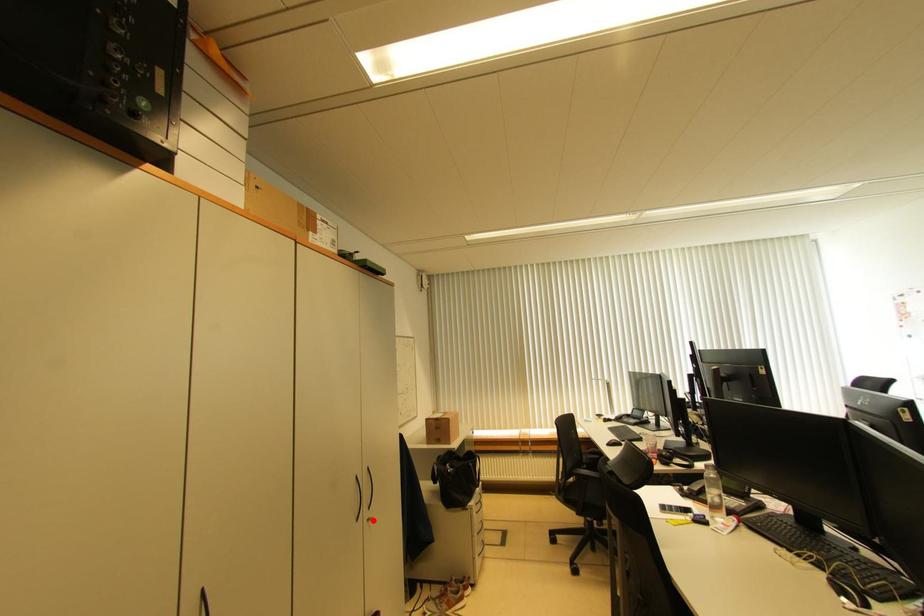
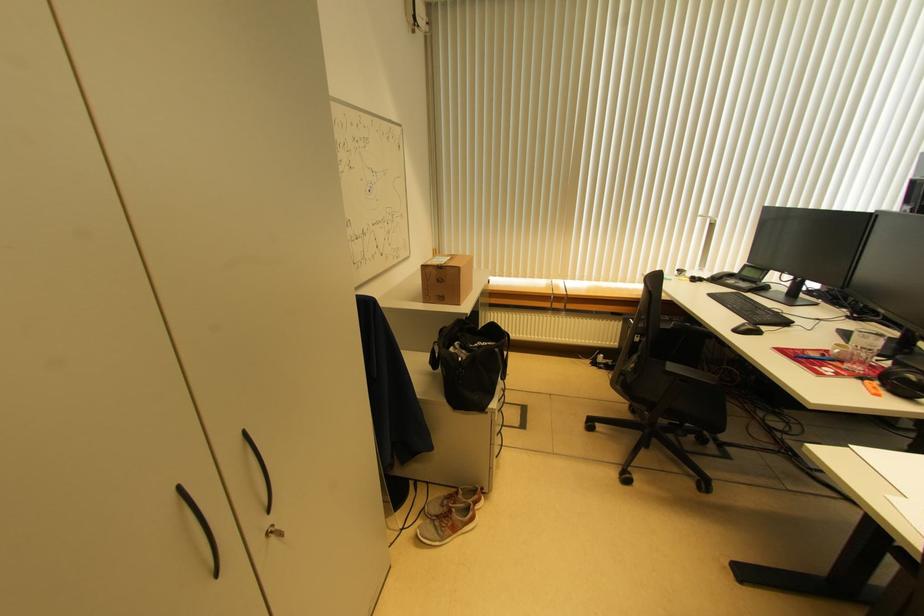
In the second image, find the point that corresponds to the highlighted location in the first image.

(280, 530)